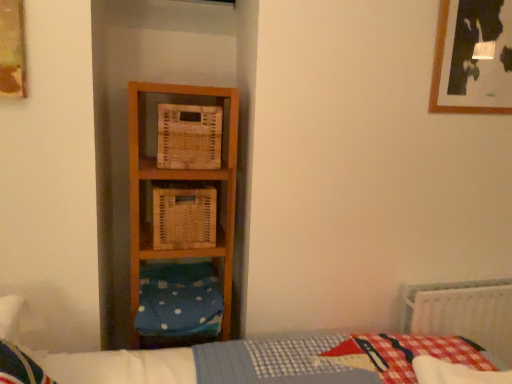
Question: Based on their sizes in the image, would you say blue polka dot fabric at lower left is bigger or smaller than woven wood crate at center, acting as the first crate starting from the top?

Choices:
 (A) big
 (B) small

Answer: (A)

Question: Does point (196, 327) appear closer or farther from the camera than point (182, 120)?

Choices:
 (A) farther
 (B) closer

Answer: (A)

Question: Considering the real-world distances, which object is farthest from the blue polka dot fabric at lower left?

Choices:
 (A) woven wicker crate at center, which is counted as the first crate, starting from the bottom
 (B) white plastic radiator at lower right
 (C) wooden picture frame at upper left, the 2th picture frame in the back-to-front sequence
 (D) wooden picture frame at upper right, which ranks as the second picture frame in front-to-back order
 (E) woven wood crate at center, which is counted as the second crate, starting from the bottom

Answer: (D)

Question: Which object is positioned farthest from the wooden picture frame at upper right, the 1th picture frame positioned from the back?

Choices:
 (A) wooden picture frame at upper left, the 2th picture frame in the back-to-front sequence
 (B) blue polka dot fabric at lower left
 (C) white plastic radiator at lower right
 (D) woven wicker crate at center, which is counted as the first crate, starting from the bottom
 (E) woven wood crate at center, acting as the first crate starting from the top

Answer: (A)